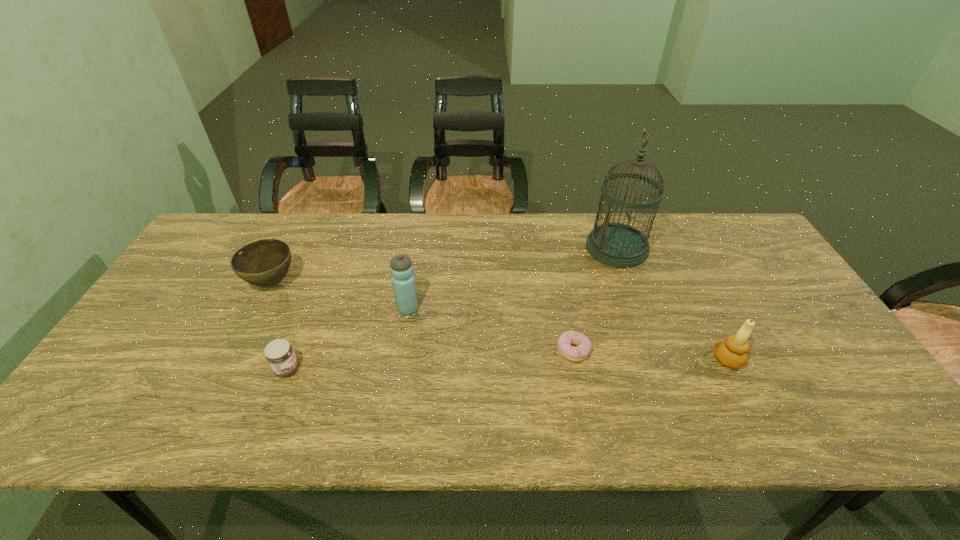
Where is `vacant region that satisfies the following two spatial constraints: 1. on the front side of the doughnut; 2. on the front label of the second shortest object`? The height and width of the screenshot is (540, 960). vacant region that satisfies the following two spatial constraints: 1. on the front side of the doughnut; 2. on the front label of the second shortest object is located at coordinates (576, 369).

Find the location of `free region that satisfies the following two spatial constraints: 1. on the front-facing side of the candle_holder; 2. on the left side of the birdcage`. free region that satisfies the following two spatial constraints: 1. on the front-facing side of the candle_holder; 2. on the left side of the birdcage is located at coordinates (657, 360).

The image size is (960, 540). Find the location of `vacant space that satisfies the following two spatial constraints: 1. on the front-facing side of the tallest object; 2. on the front side of the leftmost object`. vacant space that satisfies the following two spatial constraints: 1. on the front-facing side of the tallest object; 2. on the front side of the leftmost object is located at coordinates (629, 283).